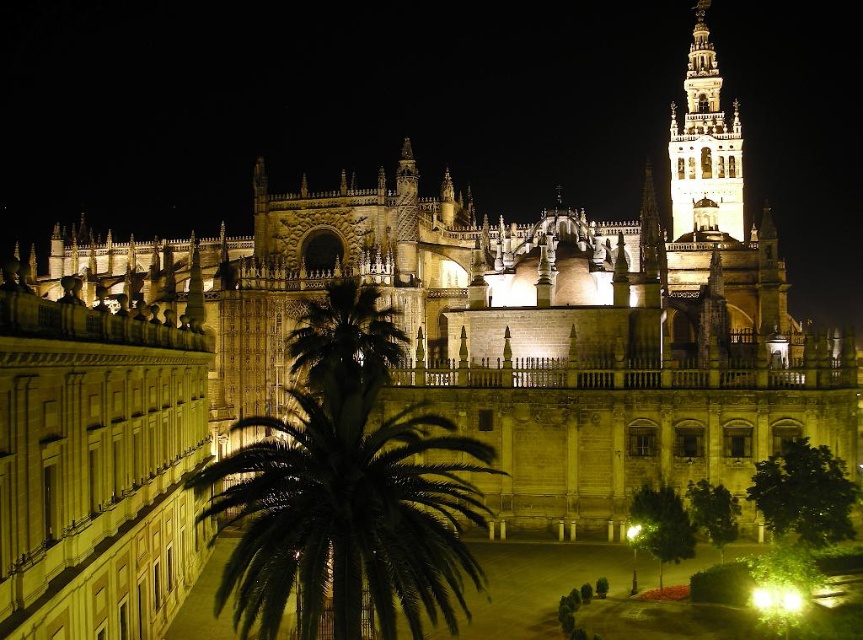
You are standing in front of the Seville Cathedral at night, and you notice two points on the cathedral facade. The first point is at coordinate point (358, 369) and the second is at coordinate point (722, 189). Which point is closer to you?

Point (358, 369) is closer to the viewer than point (722, 189).

You are a photographer standing in front of the Seville Cathedral at night. You want to capture a photo where both the green leafy palm at center and the illuminated stone bell tower at upper right are visible. Based on their heights, which object will appear taller in the photo?

The illuminated stone bell tower at upper right will appear taller in the photo because it is taller than the green leafy palm at center according to the description.